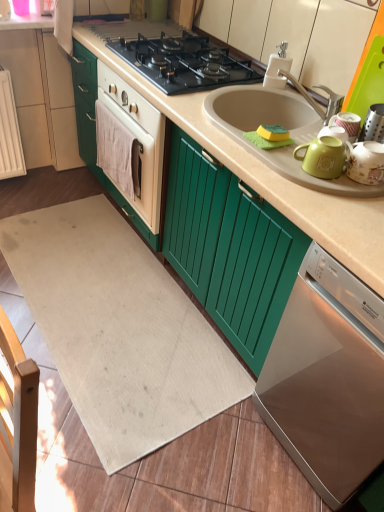
This screenshot has width=384, height=512. I want to click on white plastic faucet at upper right, so click(x=278, y=68).

Describe the element at coordinates (327, 378) in the screenshot. The height and width of the screenshot is (512, 384). I see `satin silver dishwasher at lower right` at that location.

This screenshot has height=512, width=384. In order to click on green sponge at sink in this screenshot , I will do `click(273, 133)`.

What is the approximate height of beige carpet at lower left?

1.76 inches.

In order to face matte ceramic mug at upper right, should I rotate leftwards or rightwards?

Rotate right and turn 17.026 degrees.

This screenshot has height=512, width=384. What do you see at coordinates (270, 178) in the screenshot?
I see `beige matte countertop at center` at bounding box center [270, 178].

Where is `white plastic faucet at upper right`? white plastic faucet at upper right is located at coordinates (278, 68).

From a real-world perspective, which is physically below, black matte gas stove at center or matte ceramic mug at upper right?

From a 3D spatial view, black matte gas stove at center is below.

Who is smaller, black matte gas stove at center or matte ceramic mug at upper right?

With smaller size is matte ceramic mug at upper right.

Considering the positions of objects black matte gas stove at center and matte ceramic mug at upper right in the image provided, who is more to the right, black matte gas stove at center or matte ceramic mug at upper right?

From the viewer's perspective, matte ceramic mug at upper right appears more on the right side.

Which is in front, point (85, 205) or point (277, 67)?

The point (277, 67) is in front.

From a real-world perspective, is beige carpet at lower left physically located above or below white plastic faucet at upper right?

beige carpet at lower left is situated lower than white plastic faucet at upper right in the real world.

Considering the relative positions of beige carpet at lower left and white plastic faucet at upper right in the image provided, is beige carpet at lower left to the left or to the right of white plastic faucet at upper right?

Based on their positions, beige carpet at lower left is located to the left of white plastic faucet at upper right.

Is the position of beige carpet at lower left less distant than that of white plastic faucet at upper right?

Yes, beige carpet at lower left is in front of white plastic faucet at upper right.

From the image's perspective, is black matte gas stove at center above matte green tea pot at right?

Yes, from the image's perspective, black matte gas stove at center is on top of matte green tea pot at right.

From a real-world perspective, is black matte gas stove at center located higher than matte green tea pot at right?

No, from a real-world perspective, black matte gas stove at center is not over matte green tea pot at right

How distant is black matte gas stove at center from matte green tea pot at right?

black matte gas stove at center is 32.33 inches away from matte green tea pot at right.

How different are the orientations of black matte gas stove at center and matte green tea pot at right in degrees?

26.8 degrees.

Is white cloth towel at center taller or shorter than beige carpet at lower left?

white cloth towel at center is taller than beige carpet at lower left.

Measure the distance from white cloth towel at center to beige carpet at lower left.

white cloth towel at center and beige carpet at lower left are 23.71 inches apart from each other.

Is white cloth towel at center not inside beige carpet at lower left?

Yes, white cloth towel at center is not within beige carpet at lower left.

Is point (119, 160) positioned in front of point (101, 208)?

That is True.

Is beige matte countertop at center wider than beige carpet at lower left?

In fact, beige matte countertop at center might be narrower than beige carpet at lower left.

From a real-world perspective, is beige matte countertop at center located beneath beige carpet at lower left?

Incorrect, from a real-world perspective, beige matte countertop at center is higher than beige carpet at lower left.

Would you say beige matte countertop at center is a long distance from beige carpet at lower left?

That's not correct — beige matte countertop at center is a little close to beige carpet at lower left.

Based on the photo, is the position of beige matte countertop at center more distant than that of beige carpet at lower left?

That is False.

From the image's perspective, which is below, satin silver dishwasher at lower right or black matte gas stove at center?

satin silver dishwasher at lower right is shown below in the image.

Can we say satin silver dishwasher at lower right lies outside black matte gas stove at center?

satin silver dishwasher at lower right is positioned outside black matte gas stove at center.

Is satin silver dishwasher at lower right positioned far away from black matte gas stove at center?

Yes, satin silver dishwasher at lower right and black matte gas stove at center are quite far apart.

Can you confirm if satin silver dishwasher at lower right is wider than black matte gas stove at center?

Yes, satin silver dishwasher at lower right is wider than black matte gas stove at center.

Considering the sizes of objects matte ceramic mug at upper right and white plastic faucet at upper right in the image provided, who is shorter, matte ceramic mug at upper right or white plastic faucet at upper right?

matte ceramic mug at upper right is shorter.

From the image's perspective, which object appears higher, matte ceramic mug at upper right or white plastic faucet at upper right?

white plastic faucet at upper right appears higher in the image.

Is matte ceramic mug at upper right inside or outside of white plastic faucet at upper right?

The correct answer is: outside.

Does matte ceramic mug at upper right have a smaller size compared to white plastic faucet at upper right?

Correct, matte ceramic mug at upper right occupies less space than white plastic faucet at upper right.

At what (x,y) coordinates should I click in order to perform the action: click on teal above the black matte gas stove at center (from a real-world perspective). Please return your answer as a coordinate pair (x, y). The width and height of the screenshot is (384, 512). Looking at the image, I should click on (323, 157).

I want to click on wide that is below the white plastic faucet at upper right (from the image's perspective), so click(119, 329).

Which object lies further to the anchor point green sponge at sink, satin silver dishwasher at lower right or matte green tea pot at right?

satin silver dishwasher at lower right is positioned further to the anchor green sponge at sink.

From the image, which object appears to be nearer to green sponge at sink, matte green tea pot at right or beige carpet at lower left?

matte green tea pot at right is closer to green sponge at sink.

Which object lies nearer to the anchor point white cloth towel at center, black matte gas stove at center or beige matte countertop at center?

black matte gas stove at center lies closer to white cloth towel at center than the other object.

Looking at the image, which one is located closer to beige matte countertop at center, white cloth towel at center or beige carpet at lower left?

white cloth towel at center is positioned closer to the anchor beige matte countertop at center.

Looking at the image, which one is located closer to green sponge at sink, matte green tea pot at right or white plastic faucet at upper right?

matte green tea pot at right is closer to green sponge at sink.

Considering their positions, is green sponge at sink positioned further to white plastic faucet at upper right than black matte gas stove at center?

green sponge at sink lies further to white plastic faucet at upper right than the other object.

Looking at the image, which one is located further to matte green tea pot at right, white plastic faucet at upper right or white cloth towel at center?

white cloth towel at center is further to matte green tea pot at right.

Which object lies further to the anchor point white plastic faucet at upper right, matte ceramic mug at upper right or white cloth towel at center?

white cloth towel at center is further to white plastic faucet at upper right.

I want to click on counter top between beige carpet at lower left and matte green tea pot at right, so click(x=270, y=178).

I want to click on tea pot between white plastic faucet at upper right and satin silver dishwasher at lower right in the vertical direction, so click(x=365, y=162).

Image resolution: width=384 pixels, height=512 pixels. Find the location of `teal located between white cloth towel at center and matte green tea pot at right in the left-right direction`. teal located between white cloth towel at center and matte green tea pot at right in the left-right direction is located at coordinates (323, 157).

This screenshot has width=384, height=512. I want to click on teal between beige matte countertop at center and satin silver dishwasher at lower right vertically, so click(323, 157).